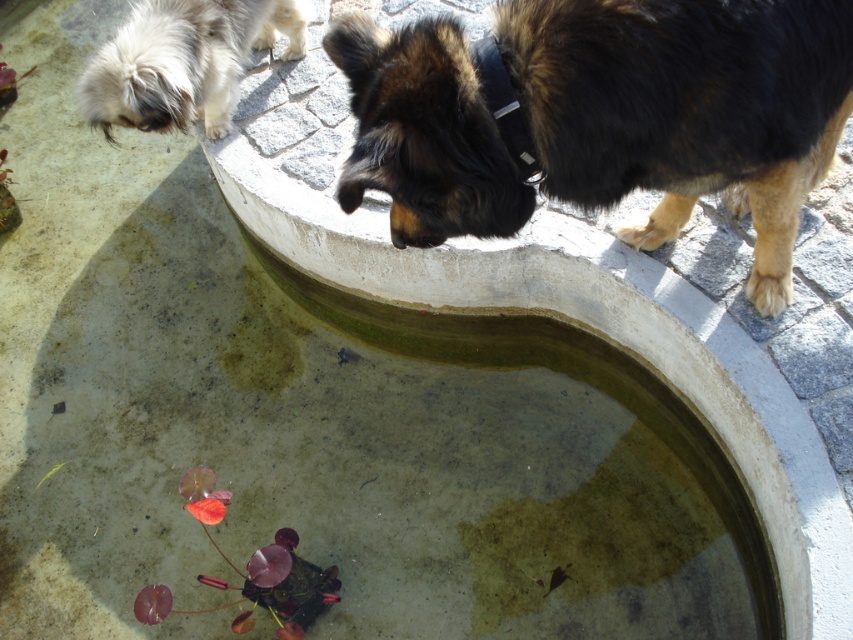
Question: Observing the image, what is the correct spatial positioning of dark brown fur at upper right in reference to white fluffy dog at upper left?

Choices:
 (A) above
 (B) below

Answer: (B)

Question: Does dark brown fur at upper right have a lesser width compared to white fluffy dog at upper left?

Choices:
 (A) yes
 (B) no

Answer: (B)

Question: Which of the following is the closest to the observer?

Choices:
 (A) (107, 84)
 (B) (602, 138)

Answer: (B)

Question: Among these points, which one is farthest from the camera?

Choices:
 (A) (91, 120)
 (B) (426, 48)

Answer: (A)

Question: Is dark brown fur at upper right positioned in front of white fluffy dog at upper left?

Choices:
 (A) yes
 (B) no

Answer: (A)

Question: Which object is closer to the camera taking this photo?

Choices:
 (A) white fluffy dog at upper left
 (B) dark brown fur at upper right

Answer: (B)